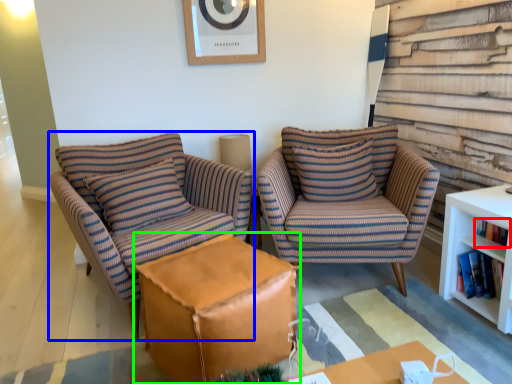
Question: Which object is positioned farthest from book (highlighted by a red box)? Select from chair (highlighted by a blue box) and table (highlighted by a green box).

Choices:
 (A) chair
 (B) table

Answer: (A)